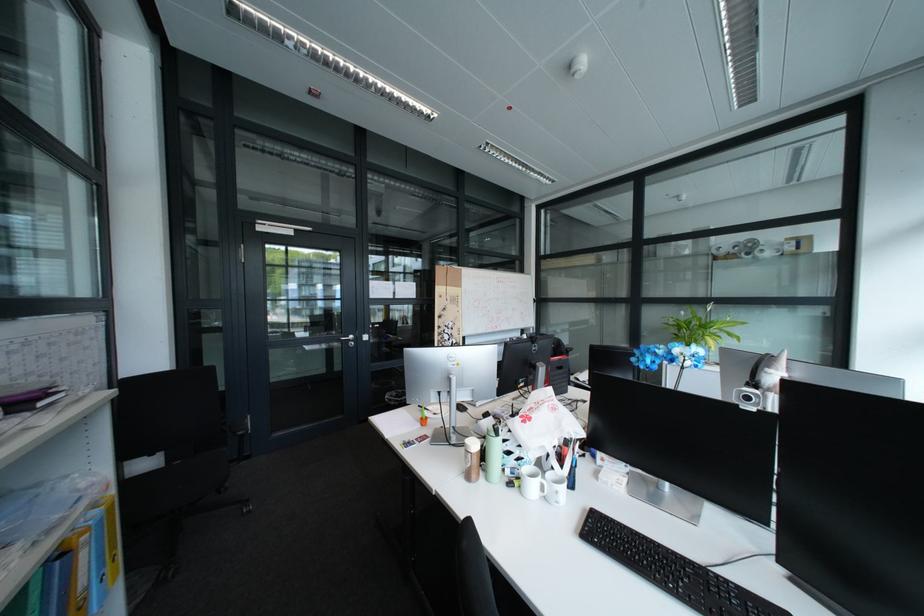
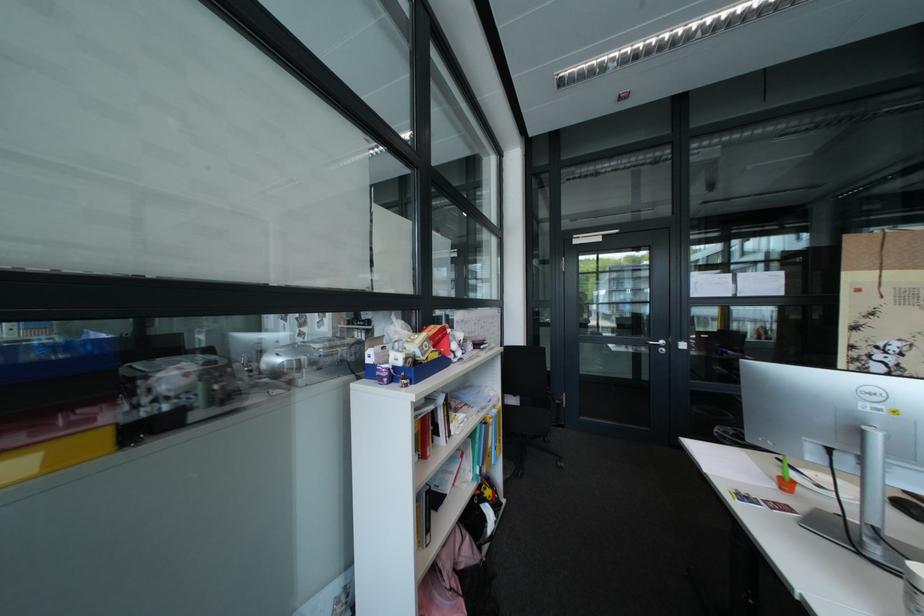
Question: The images are taken continuously from a first-person perspective. In which direction is your viewpoint rotating?

Choices:
 (A) Left
 (B) Right
 (C) Up
 (D) Down

Answer: (A)